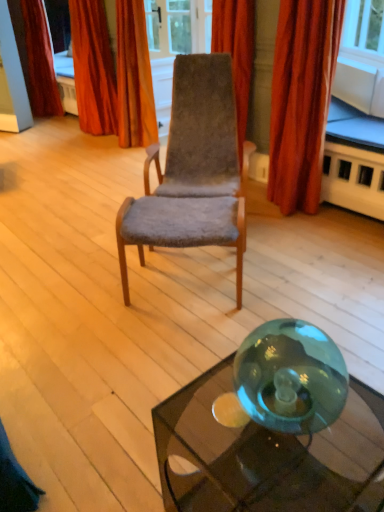
Locate an element on the screen. This screenshot has width=384, height=512. vacant position to the left of transparent glass table at lower right, which is the 2th table in top-to-bottom order is located at coordinates [129, 463].